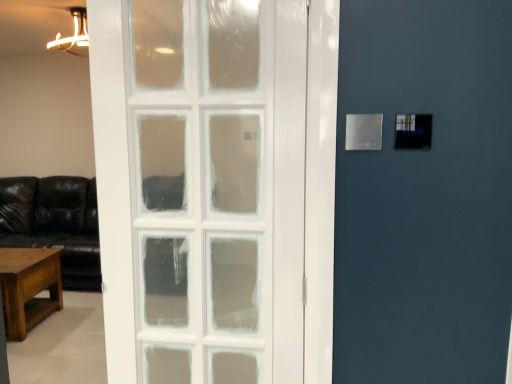
Question: Is point (362, 119) positioned closer to the camera than point (5, 291)?

Choices:
 (A) farther
 (B) closer

Answer: (B)

Question: From a real-world perspective, is transparent plastic light switch at upper right positioned above or below rustic wood table at lower left?

Choices:
 (A) below
 (B) above

Answer: (B)

Question: From the image's perspective, is transparent plastic light switch at upper right located above or below rustic wood table at lower left?

Choices:
 (A) above
 (B) below

Answer: (A)

Question: Is point (44, 264) closer or farther from the camera than point (381, 117)?

Choices:
 (A) farther
 (B) closer

Answer: (A)

Question: In terms of width, does rustic wood table at lower left look wider or thinner when compared to transparent plastic light switch at upper right?

Choices:
 (A) thin
 (B) wide

Answer: (B)

Question: In terms of height, does rustic wood table at lower left look taller or shorter compared to transparent plastic light switch at upper right?

Choices:
 (A) tall
 (B) short

Answer: (A)

Question: In the image, is rustic wood table at lower left positioned in front of or behind transparent plastic light switch at upper right?

Choices:
 (A) front
 (B) behind

Answer: (B)